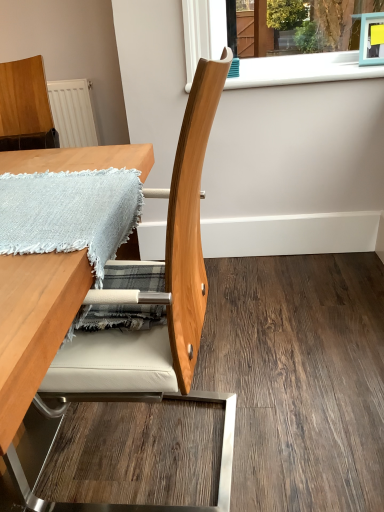
Question: Considering the relative sizes of wooden table at center and natural wood chair at center in the image provided, is wooden table at center smaller than natural wood chair at center?

Choices:
 (A) no
 (B) yes

Answer: (A)

Question: Does wooden table at center turn towards natural wood chair at center?

Choices:
 (A) yes
 (B) no

Answer: (B)

Question: Is wooden table at center further to the viewer compared to natural wood chair at center?

Choices:
 (A) no
 (B) yes

Answer: (A)

Question: From the image's perspective, is wooden table at center on natural wood chair at center?

Choices:
 (A) yes
 (B) no

Answer: (A)

Question: Considering the relative positions of wooden table at center and natural wood chair at center in the image provided, is wooden table at center to the right of natural wood chair at center from the viewer's perspective?

Choices:
 (A) yes
 (B) no

Answer: (B)

Question: Can we say wooden table at center lies outside natural wood chair at center?

Choices:
 (A) no
 (B) yes

Answer: (B)

Question: From a real-world perspective, is white plastic window sill at upper center over light blue woven blanket at upper left?

Choices:
 (A) yes
 (B) no

Answer: (A)

Question: Does white plastic window sill at upper center have a lesser width compared to light blue woven blanket at upper left?

Choices:
 (A) yes
 (B) no

Answer: (A)

Question: Are white plastic window sill at upper center and light blue woven blanket at upper left far apart?

Choices:
 (A) yes
 (B) no

Answer: (A)

Question: Is white plastic window sill at upper center outside light blue woven blanket at upper left?

Choices:
 (A) yes
 (B) no

Answer: (A)

Question: Considering the relative positions of white plastic window sill at upper center and light blue woven blanket at upper left in the image provided, is white plastic window sill at upper center behind light blue woven blanket at upper left?

Choices:
 (A) yes
 (B) no

Answer: (A)

Question: From a real-world perspective, is white plastic window sill at upper center below light blue woven blanket at upper left?

Choices:
 (A) yes
 (B) no

Answer: (B)

Question: From the image's perspective, is light blue woven blanket at upper left over white plastic window sill at upper center?

Choices:
 (A) yes
 (B) no

Answer: (B)